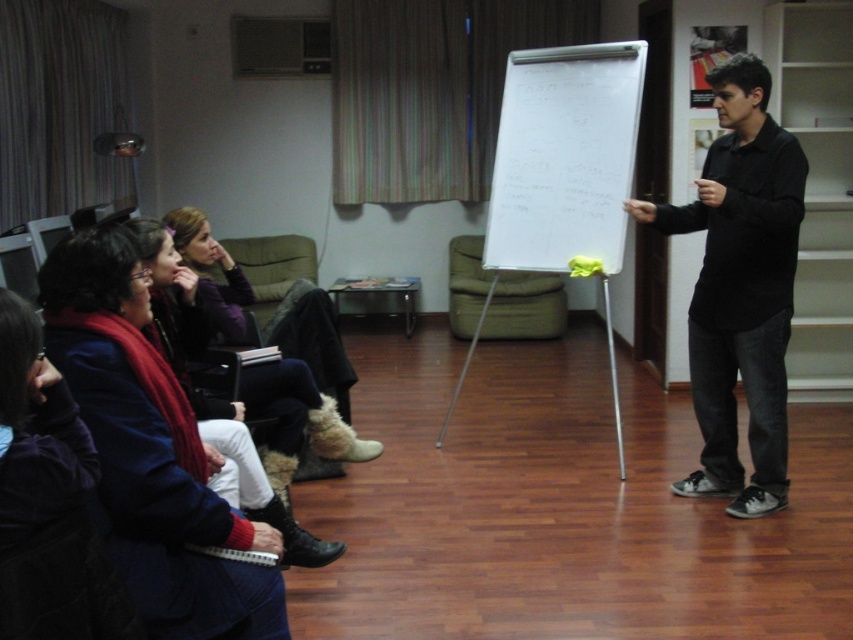
Question: Which of these objects is positioned farthest from the dark purple sweater at lower left?

Choices:
 (A) whiteboard at center
 (B) black matte shirt at center

Answer: (A)

Question: Is whiteboard at center wider than velvet purple sweater at center left?

Choices:
 (A) yes
 (B) no

Answer: (A)

Question: Is whiteboard at center behind dark purple sweater at lower left?

Choices:
 (A) yes
 (B) no

Answer: (A)

Question: Is whiteboard at center positioned before velvet purple sweater at center left?

Choices:
 (A) yes
 (B) no

Answer: (B)

Question: Estimate the real-world distances between objects in this image. Which object is farther from the dark purple sweater at lower left?

Choices:
 (A) black matte shirt at center
 (B) velvet purple sweater at center left

Answer: (A)

Question: Among these objects, which one is farthest from the camera?

Choices:
 (A) velvet purple sweater at center left
 (B) whiteboard at center
 (C) black matte shirt at center
 (D) dark purple sweater at lower left

Answer: (B)